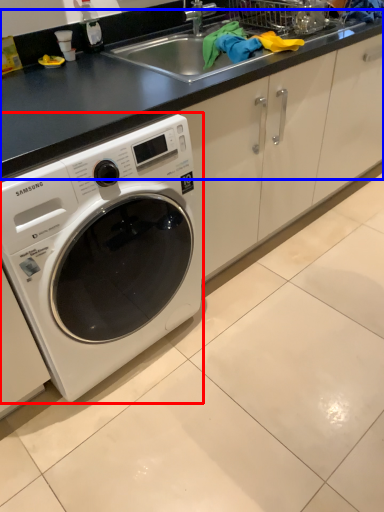
Question: Which object appears farthest to the camera in this image, washing machine (highlighted by a red box) or counter top (highlighted by a blue box)?

Choices:
 (A) washing machine
 (B) counter top

Answer: (B)